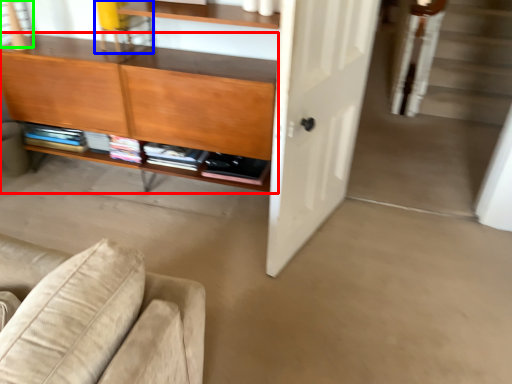
Question: Estimate the real-world distances between objects in this image. Which object is farther from cabinetry (highlighted by a red box), chair (highlighted by a blue box) or window (highlighted by a green box)?

Choices:
 (A) chair
 (B) window

Answer: (B)